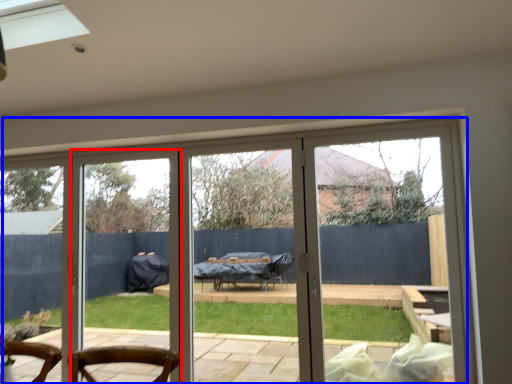
Question: Which object appears closest to the camera in this image, screen door (highlighted by a red box) or door (highlighted by a blue box)?

Choices:
 (A) screen door
 (B) door

Answer: (B)